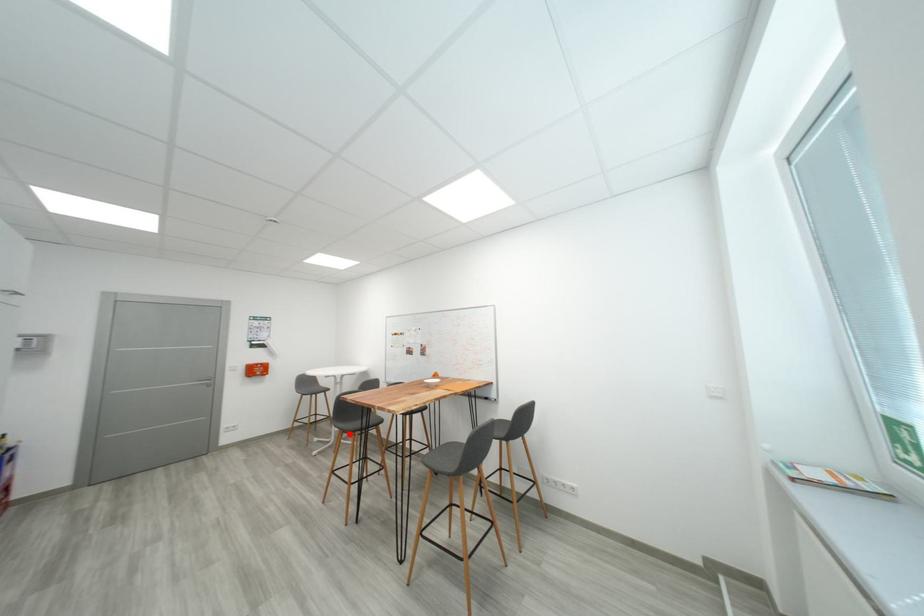
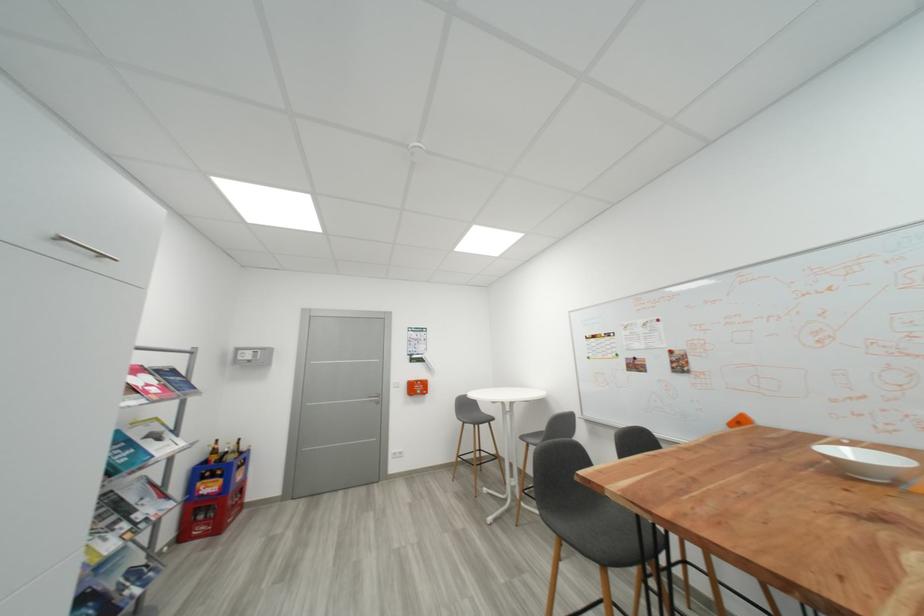
Question: I am providing you with two images of the same scene from different viewpoints. A red point is shown in image1. For the corresponding object point in image2, is it positioned nearer or farther from the camera?

Choices:
 (A) Nearer
 (B) Farther

Answer: (A)